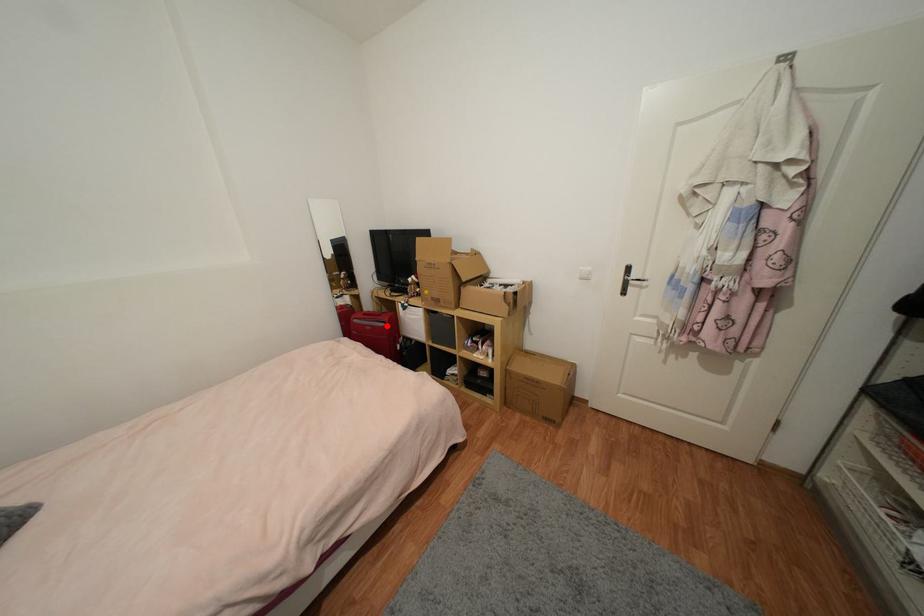
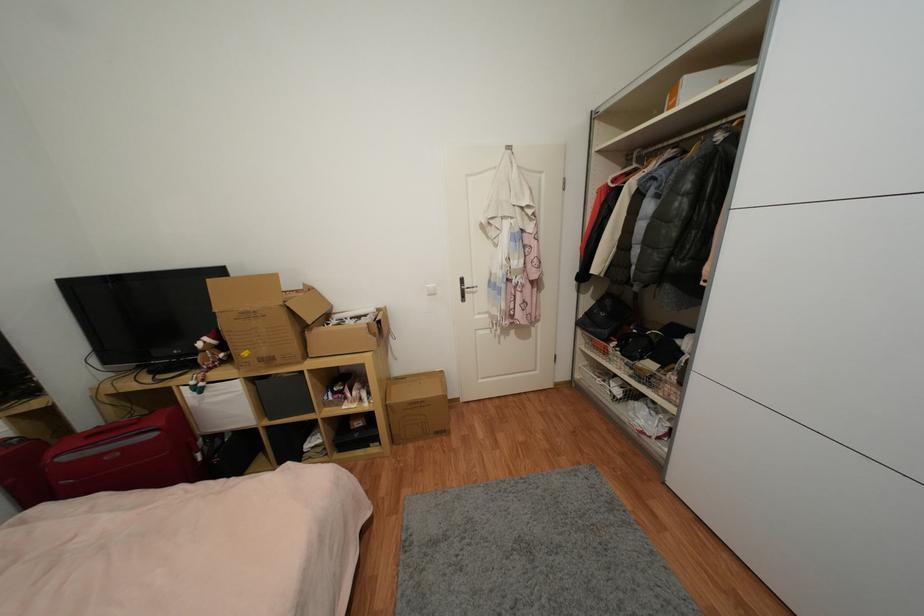
The point at the highlighted location is marked in the first image. Where is the corresponding point in the second image?

(157, 436)